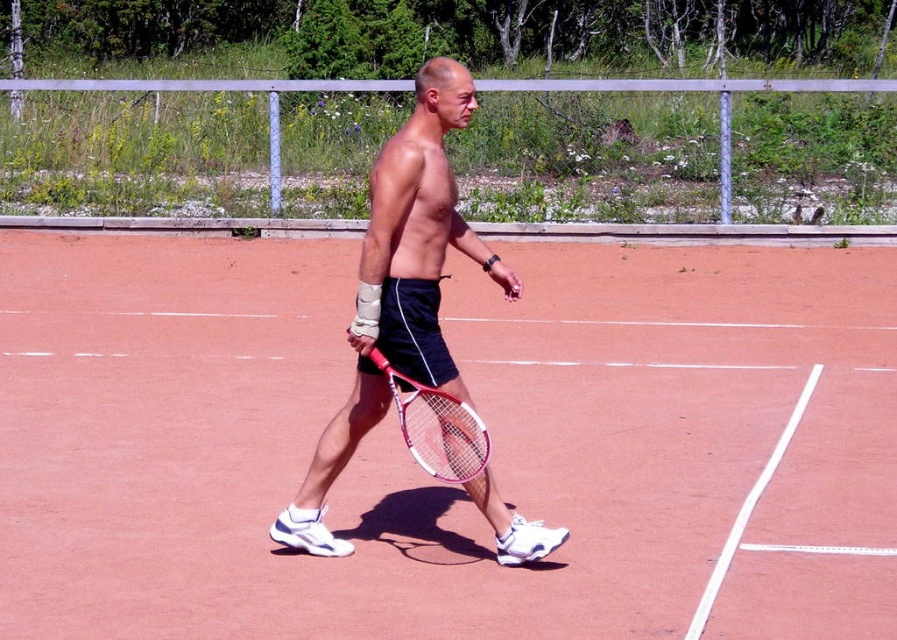
Does matte black shorts at center appear on the left side of white frame tennis racket at center?

No, matte black shorts at center is not to the left of white frame tennis racket at center.

Does matte black shorts at center have a larger size compared to white frame tennis racket at center?

Yes, matte black shorts at center is bigger than white frame tennis racket at center.

Who is more distant from viewer, (305, 531) or (443, 413)?

The point (305, 531) is behind.

Image resolution: width=897 pixels, height=640 pixels. I want to click on matte black shorts at center, so click(398, 289).

Can you confirm if coral clay tennis court at center is thinner than white frame tennis racket at center?

Incorrect, coral clay tennis court at center's width is not less than white frame tennis racket at center's.

Is coral clay tennis court at center below white frame tennis racket at center?

No.

Is point (67, 456) less distant than point (471, 424)?

No, (67, 456) is behind (471, 424).

You are a GUI agent. You are given a task and a screenshot of the screen. Output one action in this format:
    pyautogui.click(x=<x>, y=<y>)
    Task: Click on the coral clay tennis court at center
    The height and width of the screenshot is (640, 897).
    Given the screenshot: What is the action you would take?
    pyautogui.click(x=425, y=474)

Between coral clay tennis court at center and matte black shorts at center, which one is positioned higher?

matte black shorts at center

Is coral clay tennis court at center shorter than matte black shorts at center?

No, coral clay tennis court at center is not shorter than matte black shorts at center.

Is point (612, 474) farther from camera compared to point (392, 358)?

That is True.

Identify the location of coral clay tennis court at center. The image size is (897, 640). (425, 474).